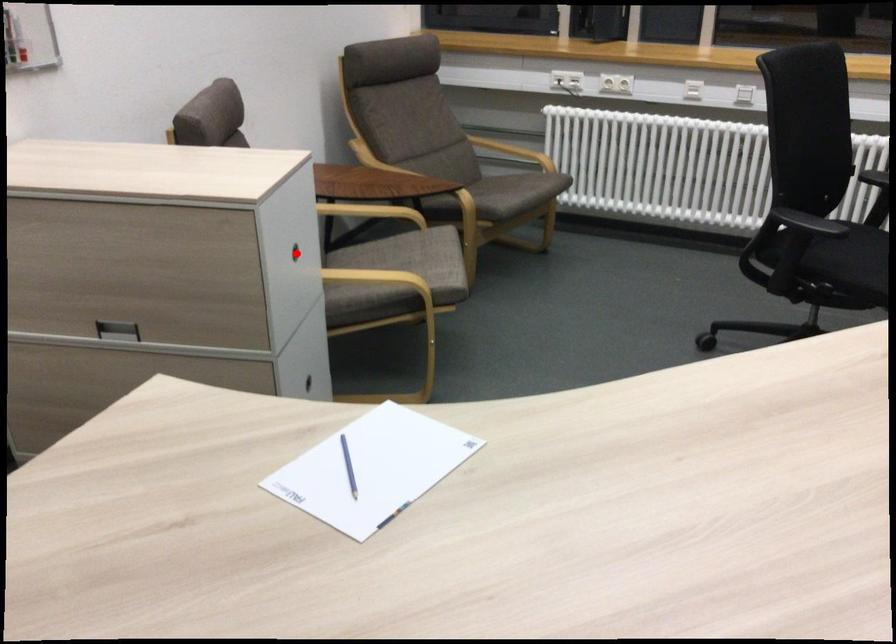
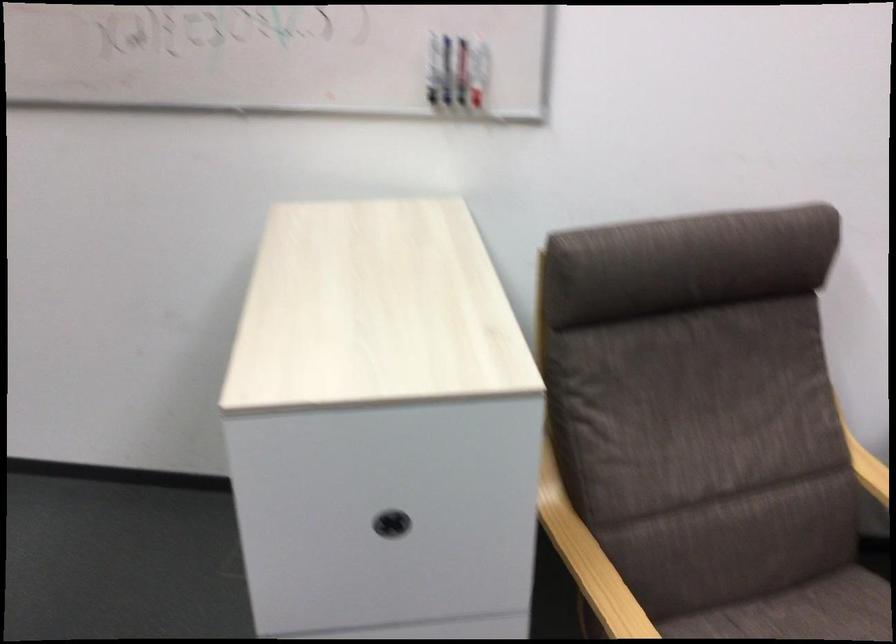
In the second image, find the point that corresponds to the highlighted location in the first image.

(391, 524)